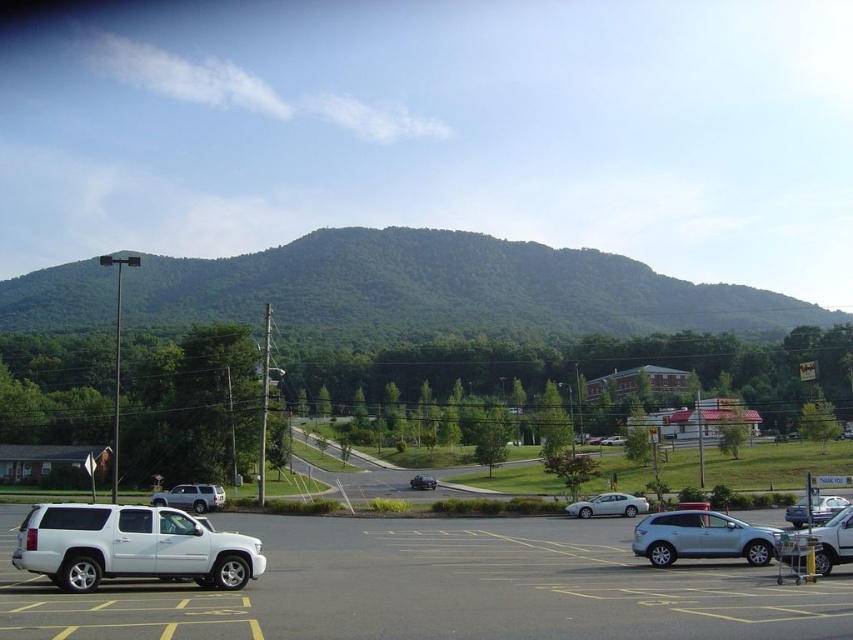
Question: Based on their relative distances, which object is farther from the green leafy mountain at center?

Choices:
 (A) white matte suv at left
 (B) satin silver sedan at center
 (C) silver metallic sedan at center

Answer: (A)

Question: Is white matte suv at lower left smaller than silver metallic suv at lower right?

Choices:
 (A) no
 (B) yes

Answer: (A)

Question: Based on their relative distances, which object is nearer to the satin silver sedan at center?

Choices:
 (A) white matte suv at center
 (B) silver metallic suv at lower right
 (C) silver metallic sedan at center
 (D) green leafy mountain at center

Answer: (B)

Question: Does white matte suv at left have a smaller size compared to metallic silver sedan at center right?

Choices:
 (A) yes
 (B) no

Answer: (B)

Question: Which of these objects is positioned farthest from the white matte suv at center?

Choices:
 (A) satin silver sedan at center
 (B) white matte suv at center-left
 (C) white matte suv at lower left
 (D) metallic silver sedan at center right

Answer: (B)

Question: Can you confirm if white matte suv at center is positioned above satin silver sedan at center?

Choices:
 (A) yes
 (B) no

Answer: (A)